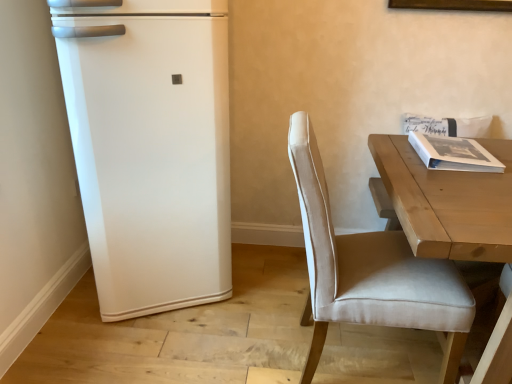
Question: Is white matte refrigerator at left in front of or behind light brown wooden table at right in the image?

Choices:
 (A) front
 (B) behind

Answer: (B)

Question: Considering the positions of white matte refrigerator at left and light brown wooden table at right in the image, is white matte refrigerator at left wider or thinner than light brown wooden table at right?

Choices:
 (A) thin
 (B) wide

Answer: (A)

Question: Which object is positioned farthest from the white matte book at upper right?

Choices:
 (A) beige fabric chair at right
 (B) light brown wooden table at right
 (C) white matte refrigerator at left

Answer: (C)

Question: Which object is the closest to the white matte book at upper right?

Choices:
 (A) light brown wooden table at right
 (B) beige fabric chair at right
 (C) white matte refrigerator at left

Answer: (A)